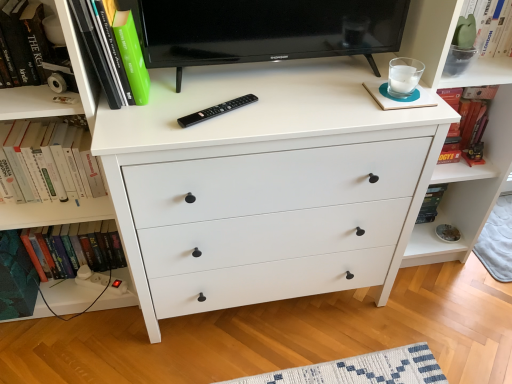
Where is `empty space that is in between black plastic remote at center and green matte book at upper left, the first book from the top`? Image resolution: width=512 pixels, height=384 pixels. empty space that is in between black plastic remote at center and green matte book at upper left, the first book from the top is located at coordinates (177, 102).